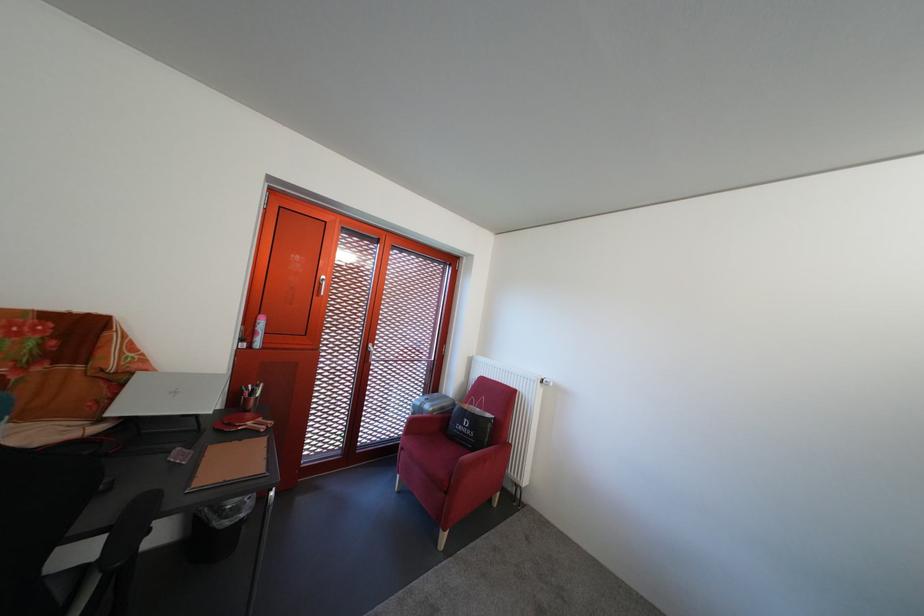
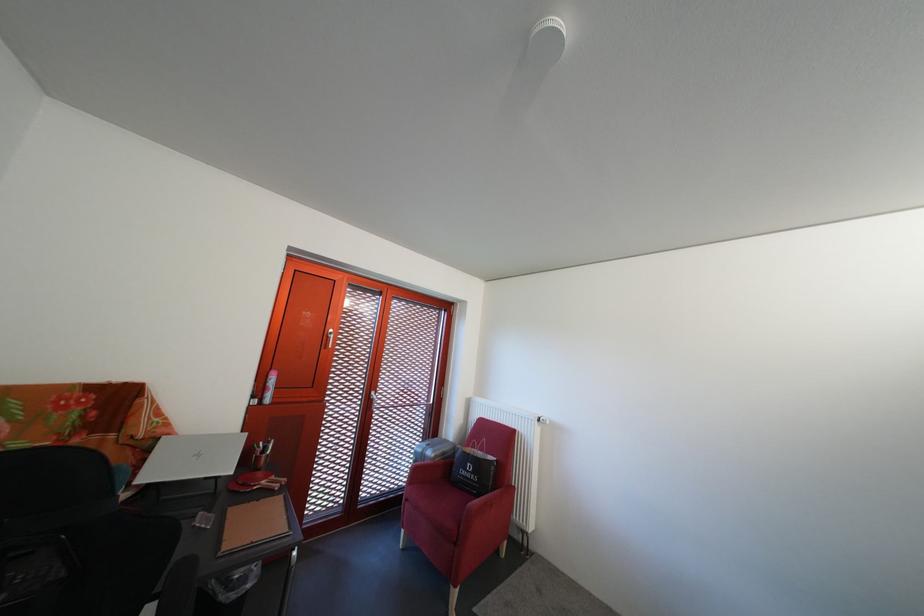
Which direction would the cameraman need to move to produce the second image?

The cameraman walked toward left, backward.